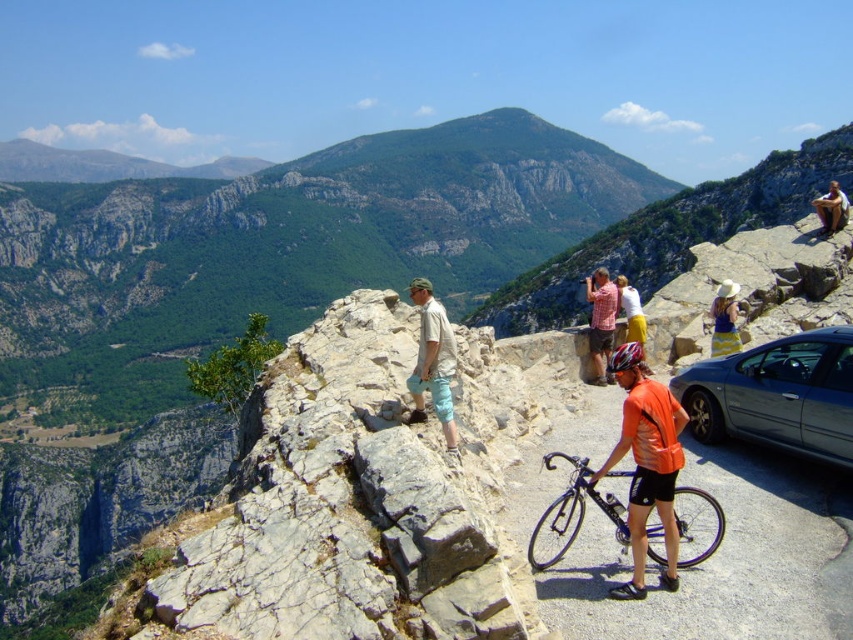
Question: Which point is closer to the camera taking this photo?

Choices:
 (A) (712, 316)
 (B) (595, 340)
 (C) (634, 408)

Answer: (C)

Question: Does orange fabric cyclist at center come in front of black metallic bicycle at center?

Choices:
 (A) yes
 (B) no

Answer: (A)

Question: Among these objects, which one is nearest to the camera?

Choices:
 (A) white cotton shirt at center
 (B) metallic blue car at center-right
 (C) matte pink shirt at center
 (D) orange fabric cyclist at center

Answer: (D)

Question: Which point is farther from the camera taking this photo?

Choices:
 (A) (643, 468)
 (B) (448, 362)

Answer: (B)

Question: Can you confirm if gray rock at upper center is thinner than white cotton shirt at center?

Choices:
 (A) yes
 (B) no

Answer: (A)

Question: Can you confirm if black metallic bicycle at center is positioned to the left of yellow striped dress at center?

Choices:
 (A) yes
 (B) no

Answer: (A)